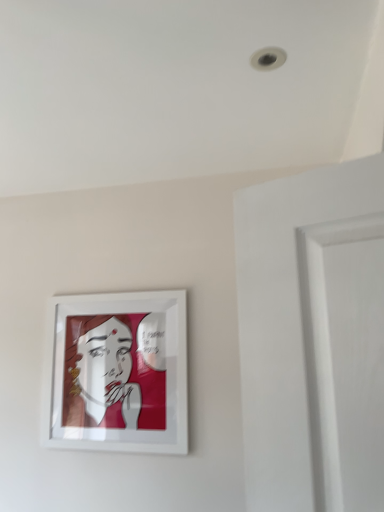
Describe the element at coordinates (117, 373) in the screenshot. I see `white glossy picture frame at upper center` at that location.

Measure the distance between white glossy picture frame at upper center and camera.

white glossy picture frame at upper center is 5.30 feet from camera.

Measure the distance between point (x=128, y=368) and camera.

The depth of point (x=128, y=368) is 5.65 feet.

This screenshot has height=512, width=384. Find the location of `white glossy picture frame at upper center`. white glossy picture frame at upper center is located at coordinates (117, 373).

Image resolution: width=384 pixels, height=512 pixels. I want to click on white glossy picture frame at upper center, so click(x=117, y=373).